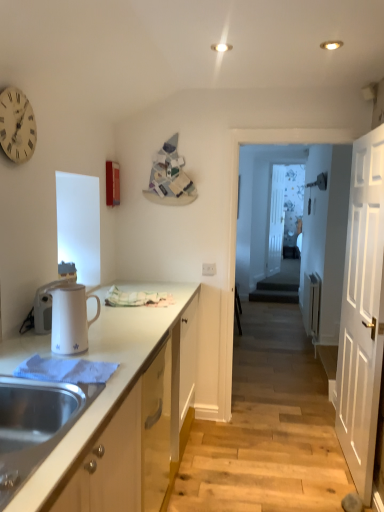
This screenshot has width=384, height=512. I want to click on vacant region to the left of white wooden door at right, so click(294, 462).